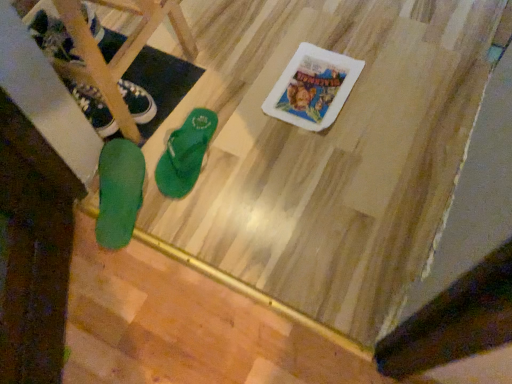
Find the location of a particular element. The width and height of the screenshot is (512, 384). vacant location behind green rubber flip-flop at center, marked as the first footwear in a right-to-left arrangement is located at coordinates (189, 95).